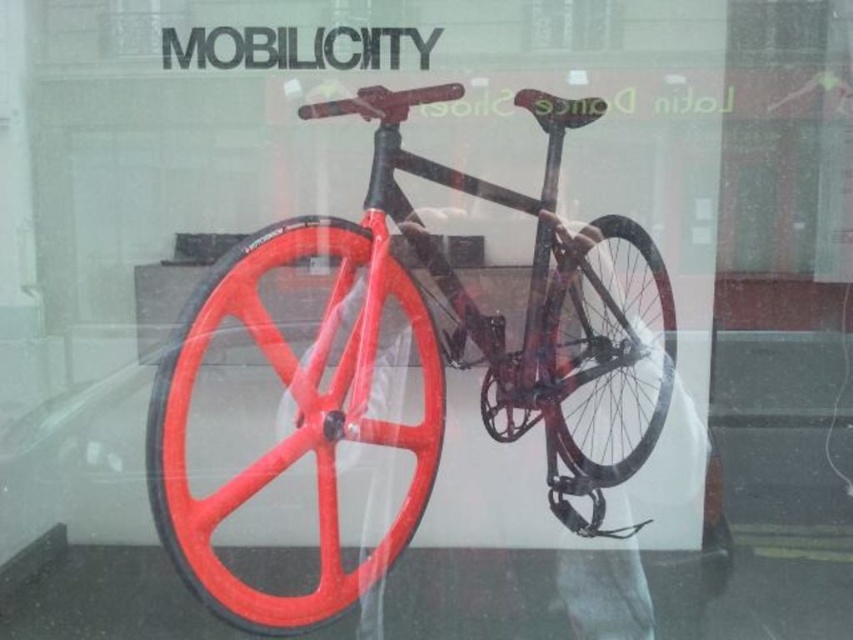
Question: Is the position of shiny red rim at center more distant than that of matte black wheel at center?

Choices:
 (A) no
 (B) yes

Answer: (A)

Question: Among these points, which one is nearest to the camera?

Choices:
 (A) (393, 284)
 (B) (564, 250)
 (C) (550, 364)

Answer: (A)

Question: Which object appears farthest from the camera in this image?

Choices:
 (A) matte black wheel at center
 (B) matte orange rimmed bicycle at center

Answer: (A)

Question: Which is nearer to the matte orange rimmed bicycle at center?

Choices:
 (A) matte black wheel at center
 (B) shiny red rim at center

Answer: (B)

Question: Does shiny red rim at center appear on the left side of matte black wheel at center?

Choices:
 (A) no
 (B) yes

Answer: (B)

Question: Is shiny red rim at center smaller than matte black wheel at center?

Choices:
 (A) yes
 (B) no

Answer: (B)